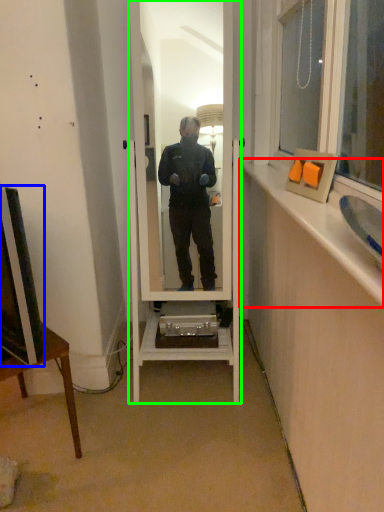
Question: Considering the real-world distances, which object is farthest from window sill (highlighted by a red box)? television (highlighted by a blue box) or mirror (highlighted by a green box)?

Choices:
 (A) television
 (B) mirror

Answer: (A)